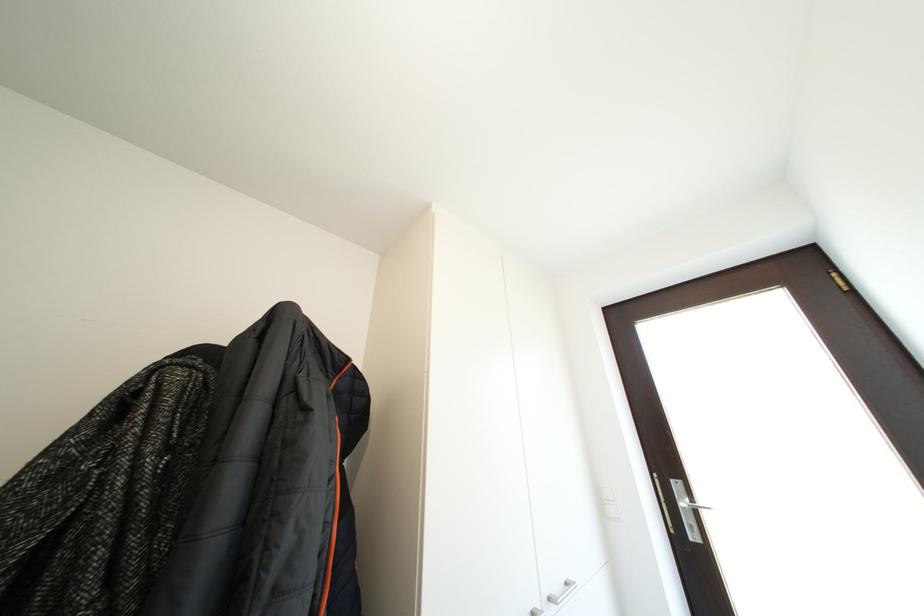
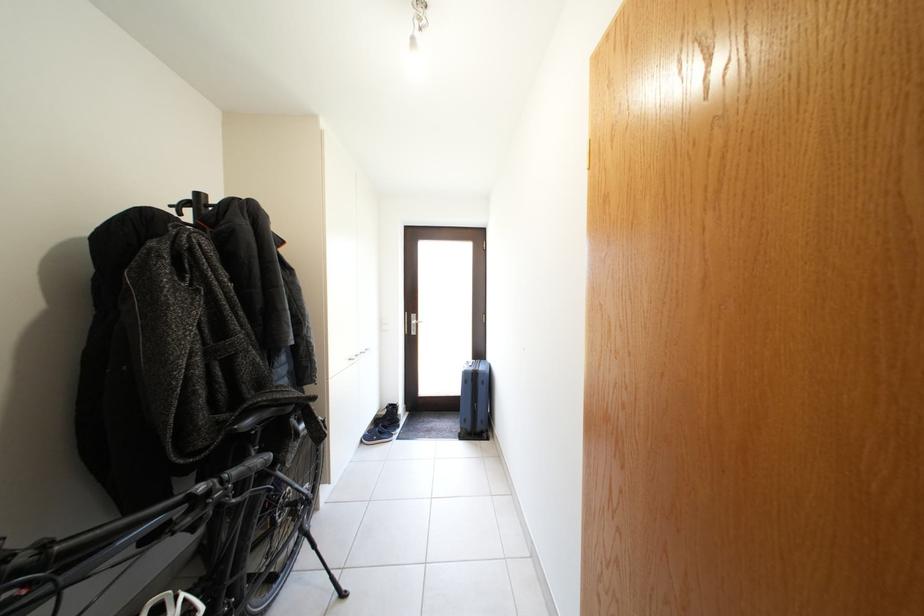
The point at (x=686, y=491) is marked in the first image. Where is the corresponding point in the second image?

(421, 322)